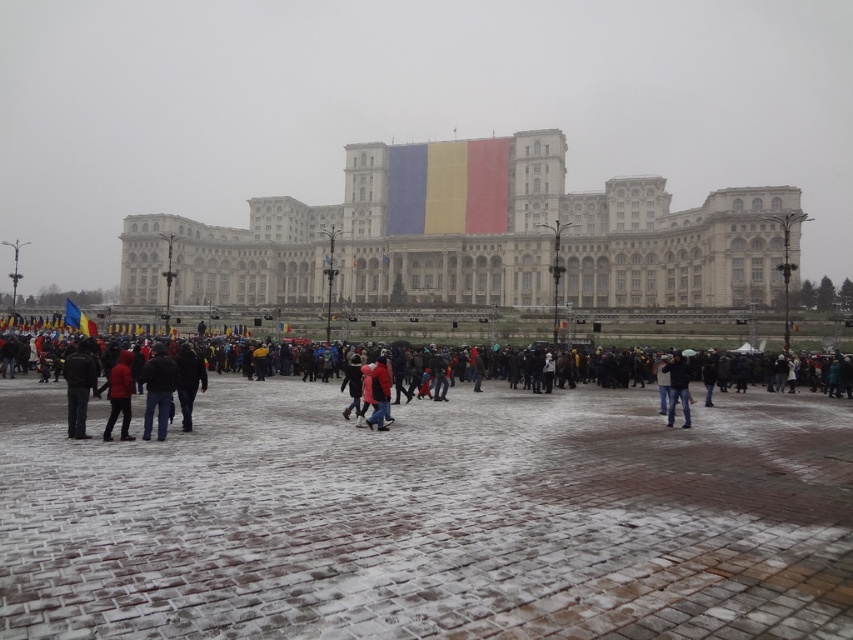
Who is positioned more to the left, white stone building at center or dark gray jacket at center?

dark gray jacket at center is more to the left.

Can you confirm if white stone building at center is smaller than dark gray jacket at center?

No, white stone building at center is not smaller than dark gray jacket at center.

The height and width of the screenshot is (640, 853). In order to click on white stone building at center in this screenshot , I will do `click(473, 236)`.

Is point (202, 388) positioned in front of point (683, 397)?

Yes, it is.

Is dark gray jacket at center wider than jeans at center?

In fact, dark gray jacket at center might be narrower than jeans at center.

Is point (186, 397) behind point (672, 394)?

That is False.

Identify the location of dark gray jacket at center. The height and width of the screenshot is (640, 853). (189, 381).

Consider the image. Who is higher up, snowy cobblestone plaza at center or dark blue jeans at center?

dark blue jeans at center

Measure the distance between snowy cobblestone plaza at center and dark blue jeans at center.

snowy cobblestone plaza at center is 19.25 meters away from dark blue jeans at center.

Does point (434, 600) come in front of point (154, 342)?

Yes, point (434, 600) is closer to viewer.

Locate an element on the screen. The image size is (853, 640). snowy cobblestone plaza at center is located at coordinates (428, 516).